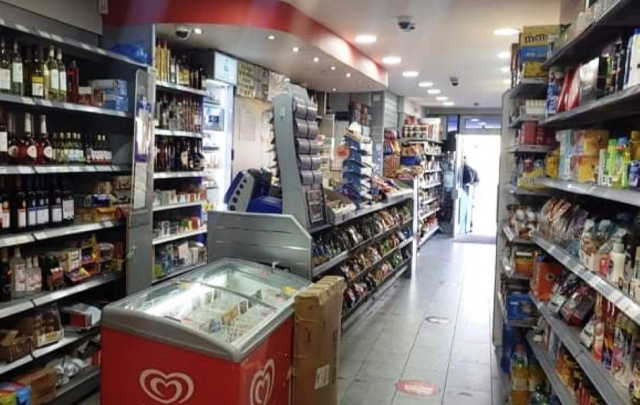
What are the coordinates of `wine bottles` in the screenshot? It's located at (54, 83), (9, 84), (38, 135).